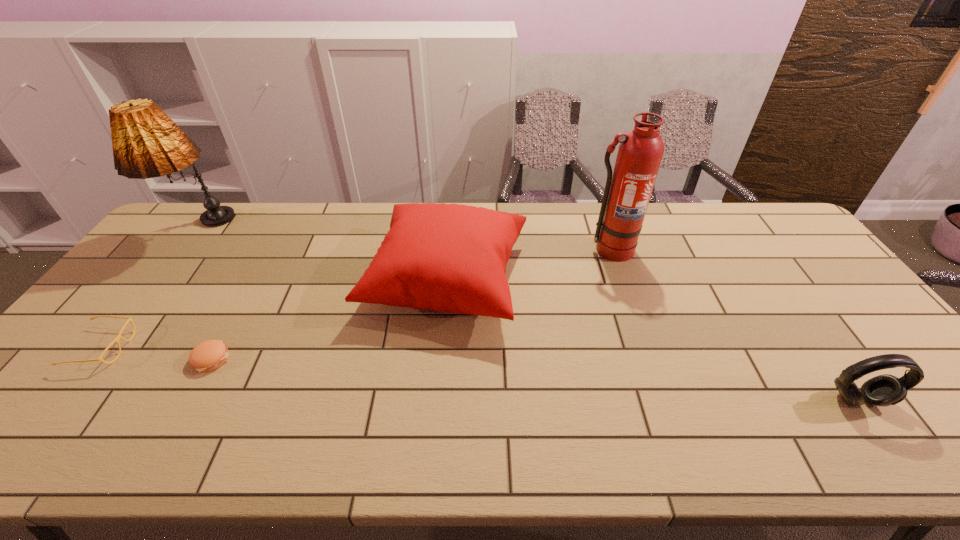
Where is `free space between the second object from right to left and the fourth object from left to right`? Image resolution: width=960 pixels, height=540 pixels. free space between the second object from right to left and the fourth object from left to right is located at coordinates (528, 265).

Identify the location of vacant point located between the fourth tallest object and the lampshade. (530, 316).

At what (x,y) coordinates should I click in order to perform the action: click on free area in between the lampshade and the fourth shortest object. Please return your answer as a coordinate pair (x, y). The height and width of the screenshot is (540, 960). Looking at the image, I should click on (324, 255).

Where is `object that is the fourth closest one to the spectacles`? The width and height of the screenshot is (960, 540). object that is the fourth closest one to the spectacles is located at coordinates (627, 193).

At what (x,y) coordinates should I click in order to perform the action: click on object that is the second closest one to the lampshade. Please return your answer as a coordinate pair (x, y). The width and height of the screenshot is (960, 540). Looking at the image, I should click on (209, 355).

Locate an element on the screen. vacant region that satisfies the following two spatial constraints: 1. on the front-facing side of the patty; 2. on the right side of the lampshade is located at coordinates (105, 359).

What are the coordinates of `free space that satisfies the following two spatial constraints: 1. on the front-facing side of the third object from right to left; 2. on the right side of the lampshade` in the screenshot? It's located at (165, 280).

Where is `free point that satisfies the following two spatial constraints: 1. on the front-facing side of the lampshade; 2. on the right side of the patty`? free point that satisfies the following two spatial constraints: 1. on the front-facing side of the lampshade; 2. on the right side of the patty is located at coordinates (105, 359).

I want to click on blank area in the image that satisfies the following two spatial constraints: 1. in front of the lenses of the spectacles; 2. on the right side of the fourth object from right to left, so click(x=93, y=359).